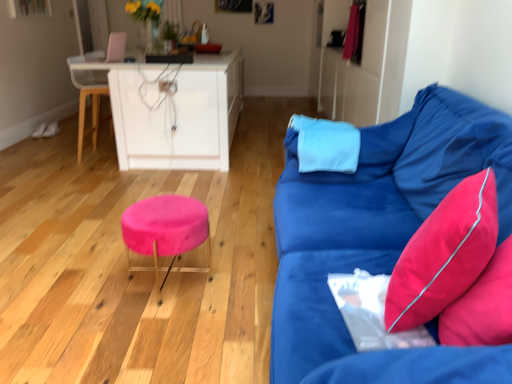
What do you see at coordinates (165, 230) in the screenshot?
I see `velvet pink stool at center` at bounding box center [165, 230].

Where is `wooden swivel chair at left`? The image size is (512, 384). wooden swivel chair at left is located at coordinates (89, 95).

How much space does light blue fabric pillow at center, placed as the 2th pillow when sorted from bottom to top, occupy vertically?

light blue fabric pillow at center, placed as the 2th pillow when sorted from bottom to top, is 10.18 inches tall.

Describe the element at coordinates (326, 145) in the screenshot. I see `light blue fabric pillow at center, which is the 2th pillow in front-to-back order` at that location.

What is the approximate width of velvet pink pillow at right, which ranks as the 1th pillow in bottom-to-top order?

velvet pink pillow at right, which ranks as the 1th pillow in bottom-to-top order, is 8.46 inches wide.

The width and height of the screenshot is (512, 384). I want to click on velvet pink stool at center, so click(165, 230).

Considering the sizes of objects velvet pink stool at center and velvet blue couch at right in the image provided, who is thinner, velvet pink stool at center or velvet blue couch at right?

With smaller width is velvet pink stool at center.

Is point (170, 248) positioned after point (327, 180)?

No, (170, 248) is in front of (327, 180).

Is velvet pink stool at center positioned far away from velvet blue couch at right?

velvet pink stool at center is actually quite close to velvet blue couch at right.

How different are the orientations of velvet pink stool at center and velvet blue couch at right in degrees?

5.57 degrees.

Is velvet blue couch at right wider than velvet pink stool at center?

Yes.

Which object is positioned more to the right, velvet blue couch at right or velvet pink stool at center?

Positioned to the right is velvet blue couch at right.

Could you tell me if velvet blue couch at right is facing velvet pink stool at center?

Yes, velvet blue couch at right is facing velvet pink stool at center.

From a real-world perspective, between velvet blue couch at right and velvet pink stool at center, who is vertically higher?

velvet blue couch at right.

Does velvet blue couch at right come in front of wooden swivel chair at left?

Yes.

Would you consider velvet blue couch at right to be distant from wooden swivel chair at left?

Yes, velvet blue couch at right and wooden swivel chair at left are quite far apart.

Does point (408, 209) appear closer or farther from the camera than point (99, 113)?

Point (408, 209) is closer to the camera than point (99, 113).

Considering the positions of objects velvet blue couch at right and wooden swivel chair at left in the image provided, who is more to the left, velvet blue couch at right or wooden swivel chair at left?

From the viewer's perspective, wooden swivel chair at left appears more on the left side.

From the picture: Is velvet pink pillow at right, the second pillow from the back, at the back of wooden swivel chair at left?

No, wooden swivel chair at left is not facing away from velvet pink pillow at right, the second pillow from the back.

Is point (93, 78) less distant than point (492, 182)?

No, it is behind (492, 182).

From the image's perspective, which object appears higher, wooden swivel chair at left or velvet pink pillow at right, acting as the first pillow starting from the front?

wooden swivel chair at left, from the image's perspective.

Is wooden swivel chair at left positioned beyond the bounds of velvet pink pillow at right, the second pillow when ordered from top to bottom?

wooden swivel chair at left lies outside velvet pink pillow at right, the second pillow when ordered from top to bottom,'s area.

From the image's perspective, is velvet blue couch at right below velvet pink pillow at right, the second pillow when ordered from top to bottom?

Yes, from the image's perspective, velvet blue couch at right is below velvet pink pillow at right, the second pillow when ordered from top to bottom.

Looking at this image, are velvet blue couch at right and velvet pink pillow at right, the second pillow from the back, located far from each other?

velvet blue couch at right is actually quite close to velvet pink pillow at right, the second pillow from the back.

Is velvet blue couch at right positioned with its back to velvet pink pillow at right, the second pillow when ordered from top to bottom?

Yes.

Is velvet blue couch at right wider than velvet pink pillow at right, the second pillow from the back?

Yes.

Could wooden swivel chair at left be considered to be inside velvet pink stool at center?

No, velvet pink stool at center does not contain wooden swivel chair at left.

Is the depth of velvet pink stool at center less than that of wooden swivel chair at left?

Yes, velvet pink stool at center is in front of wooden swivel chair at left.

From a real-world perspective, is velvet pink stool at center positioned over wooden swivel chair at left based on gravity?

No, from a real-world perspective, velvet pink stool at center is not on top of wooden swivel chair at left.

From the image's perspective, is velvet pink stool at center located beneath wooden swivel chair at left?

Yes, from the image's perspective, velvet pink stool at center is beneath wooden swivel chair at left.

Based on the photo, from the image's perspective, is velvet pink pillow at right, the second pillow from the back, above wooden swivel chair at left?

No, from the image's perspective, velvet pink pillow at right, the second pillow from the back, is not on top of wooden swivel chair at left.

Can you confirm if velvet pink pillow at right, the second pillow from the back, is smaller than wooden swivel chair at left?

Yes.

How many degrees apart are the facing directions of velvet pink pillow at right, which ranks as the 1th pillow in bottom-to-top order, and wooden swivel chair at left?

The angle between the facing direction of velvet pink pillow at right, which ranks as the 1th pillow in bottom-to-top order, and the facing direction of wooden swivel chair at left is 152 degrees.

Where is `swivel chair that is behind the velvet pink pillow at right, the second pillow when ordered from top to bottom`? This screenshot has width=512, height=384. swivel chair that is behind the velvet pink pillow at right, the second pillow when ordered from top to bottom is located at coordinates (89, 95).

Identify the location of stool located underneath the velvet blue couch at right (from a real-world perspective). This screenshot has height=384, width=512. (165, 230).

You are a GUI agent. You are given a task and a screenshot of the screen. Output one action in this format:
    pyautogui.click(x=<x>, y=<y>)
    Task: Click on the studio couch in front of the velvet pink stool at center
    The height and width of the screenshot is (384, 512).
    Given the screenshot: What is the action you would take?
    pyautogui.click(x=379, y=237)

Which object lies further to the anchor point velvet pink pillow at right, which ranks as the 1th pillow in bottom-to-top order, velvet blue couch at right or velvet pink stool at center?

velvet pink stool at center is positioned further to the anchor velvet pink pillow at right, which ranks as the 1th pillow in bottom-to-top order.

Looking at the image, which one is located closer to velvet pink stool at center, velvet pink pillow at right, which ranks as the 1th pillow in bottom-to-top order, or light blue fabric pillow at center, which is the 2th pillow in front-to-back order?

light blue fabric pillow at center, which is the 2th pillow in front-to-back order, is positioned closer to the anchor velvet pink stool at center.

Looking at the image, which one is located further to velvet pink stool at center, light blue fabric pillow at center, the 1th pillow positioned from the back, or velvet pink pillow at right, acting as the first pillow starting from the front?

velvet pink pillow at right, acting as the first pillow starting from the front, is positioned further to the anchor velvet pink stool at center.

Considering their positions, is light blue fabric pillow at center, the first pillow in the top-to-bottom sequence, positioned further to velvet pink stool at center than velvet blue couch at right?

light blue fabric pillow at center, the first pillow in the top-to-bottom sequence, is positioned further to the anchor velvet pink stool at center.

Looking at the image, which one is located closer to velvet pink pillow at right, the second pillow when ordered from top to bottom, light blue fabric pillow at center, which is the 2th pillow in front-to-back order, or velvet pink stool at center?

light blue fabric pillow at center, which is the 2th pillow in front-to-back order, is closer to velvet pink pillow at right, the second pillow when ordered from top to bottom.

Estimate the real-world distances between objects in this image. Which object is closer to light blue fabric pillow at center, the first pillow in the top-to-bottom sequence, velvet pink stool at center or velvet blue couch at right?

velvet blue couch at right is closer to light blue fabric pillow at center, the first pillow in the top-to-bottom sequence.

Which object lies further to the anchor point velvet pink stool at center, velvet pink pillow at right, the second pillow from the back, or velvet blue couch at right?

velvet pink pillow at right, the second pillow from the back, is further to velvet pink stool at center.

Looking at the image, which one is located further to velvet pink stool at center, velvet blue couch at right or light blue fabric pillow at center, which is the 2th pillow in front-to-back order?

light blue fabric pillow at center, which is the 2th pillow in front-to-back order, lies further to velvet pink stool at center than the other object.

You are a GUI agent. You are given a task and a screenshot of the screen. Output one action in this format:
    pyautogui.click(x=<x>, y=<y>)
    Task: Click on the pillow positioned between velvet pink pillow at right, the second pillow from the back, and wooden swivel chair at left from near to far
    The image size is (512, 384).
    Given the screenshot: What is the action you would take?
    pyautogui.click(x=326, y=145)

The image size is (512, 384). I want to click on stool between velvet pink pillow at right, acting as the first pillow starting from the front, and light blue fabric pillow at center, the 1th pillow positioned from the back, along the z-axis, so click(x=165, y=230).

The image size is (512, 384). Find the location of `pillow between velvet blue couch at right and light blue fabric pillow at center, placed as the 2th pillow when sorted from bottom to top, in the front-back direction`. pillow between velvet blue couch at right and light blue fabric pillow at center, placed as the 2th pillow when sorted from bottom to top, in the front-back direction is located at coordinates (444, 254).

The height and width of the screenshot is (384, 512). Identify the location of pillow located between velvet blue couch at right and velvet pink stool at center in the depth direction. (444, 254).